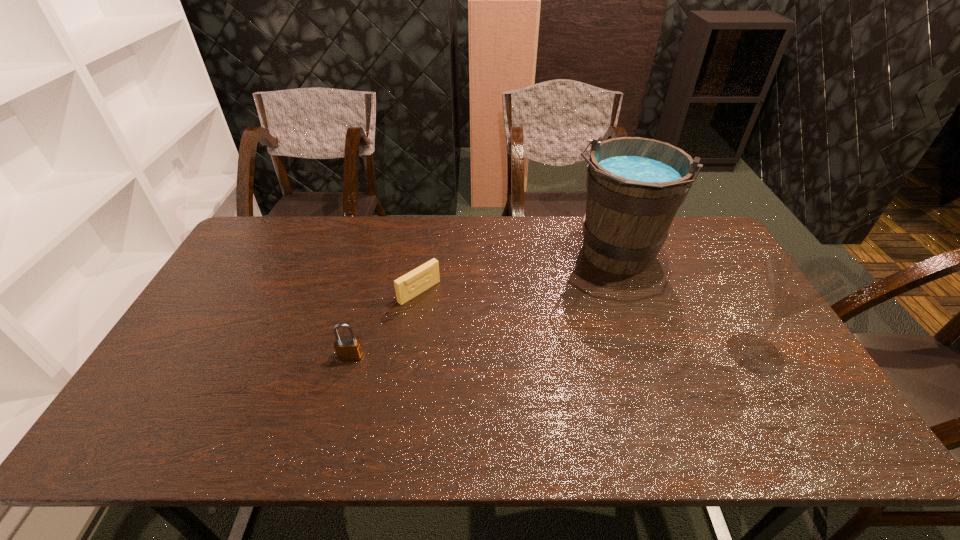
You are a GUI agent. You are given a task and a screenshot of the screen. Output one action in this format:
    pyautogui.click(x=<x>, y=<y>)
    Task: Click on the free space on the desktop that is between the third tallest object and the second tallest object and is positioned with a handle on the side of the second object from right to left
    
    Given the screenshot: What is the action you would take?
    pyautogui.click(x=562, y=355)

Locate an element on the screen. vacant space on the desktop that is between the leftmost object and the flute glass and is positioned at the front of the shortest object with spools is located at coordinates (498, 355).